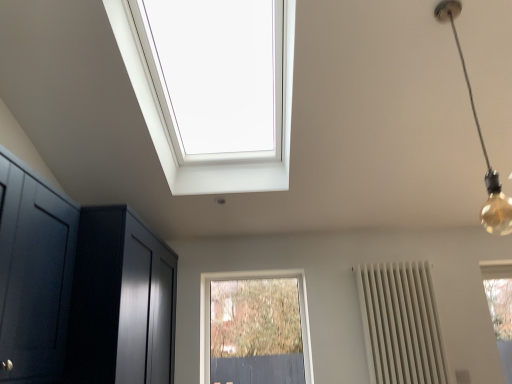
Question: From a real-world perspective, relative to white matte radiator at right, is glossy dark wood dresser at left vertically above or below?

Choices:
 (A) below
 (B) above

Answer: (B)

Question: Is glossy dark wood dresser at left spatially inside white matte radiator at right, or outside of it?

Choices:
 (A) outside
 (B) inside

Answer: (A)

Question: Which is nearer to the gold bulb at upper right?

Choices:
 (A) clear glass window at center
 (B) glossy dark wood dresser at left
 (C) white matte radiator at right

Answer: (C)

Question: Which of these objects is positioned farthest from the clear glass window at center?

Choices:
 (A) glossy dark wood dresser at left
 (B) gold bulb at upper right
 (C) white matte radiator at right

Answer: (B)